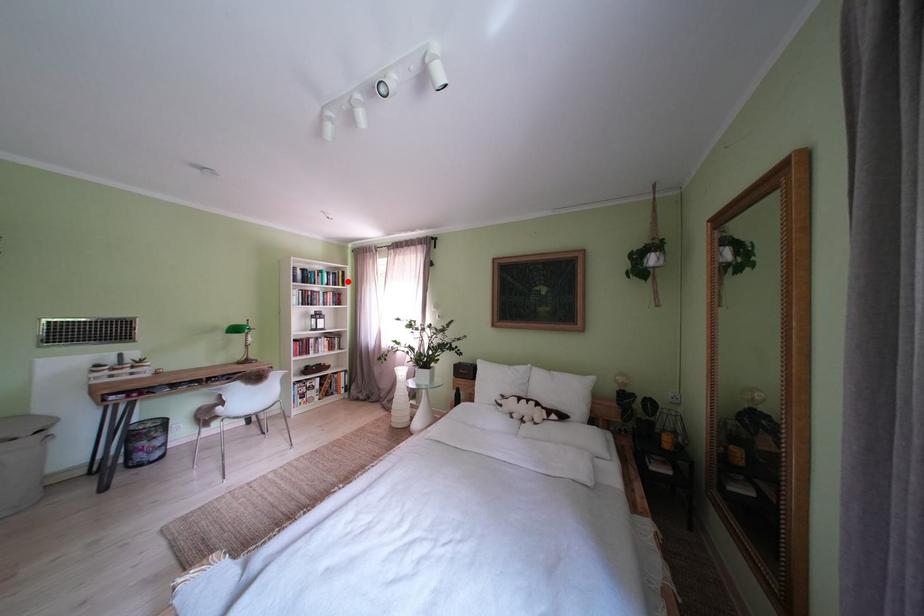
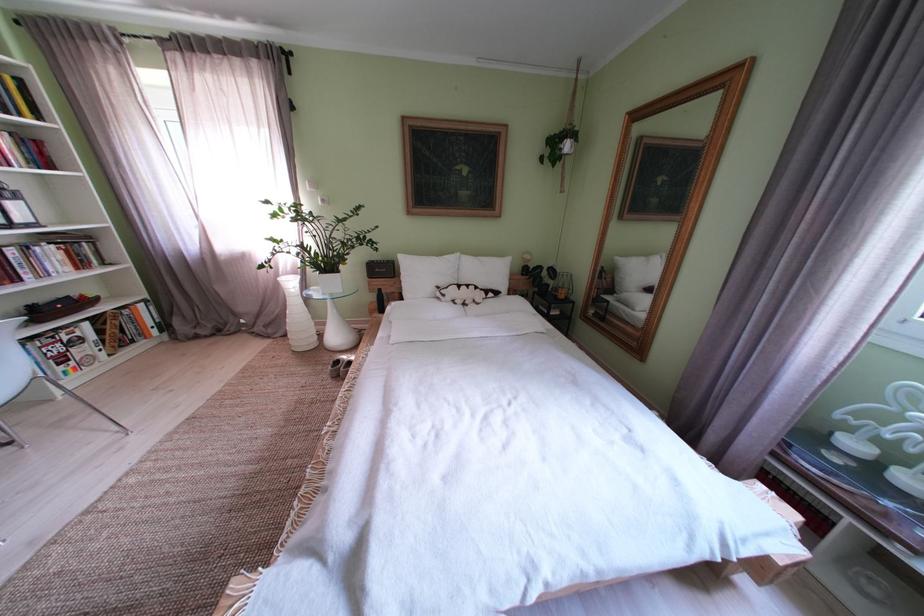
Question: A red point is marked in image1. In image2, is the corresponding 3D point closer to the camera or farther? Reply with the corresponding letter.

Choices:
 (A) The corresponding 3D point is closer.
 (B) The corresponding 3D point is farther.

Answer: (B)